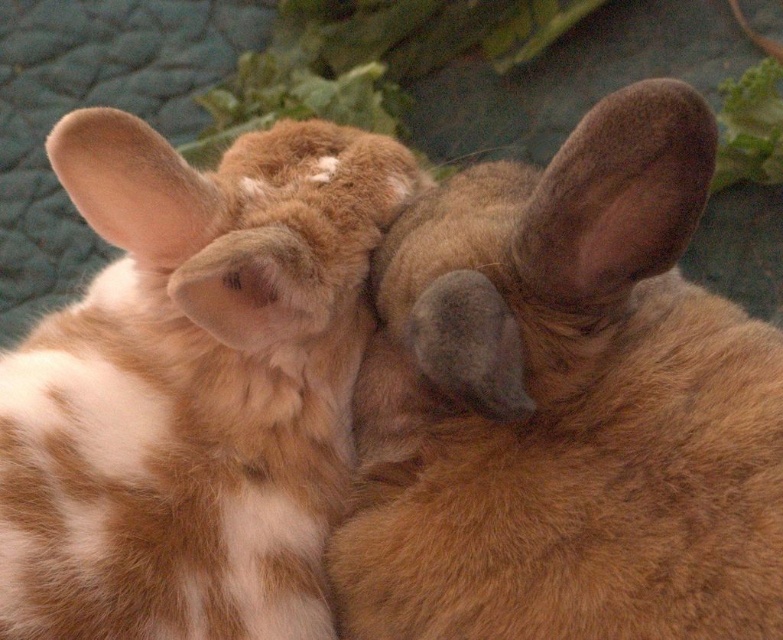
From the picture: Who is shorter, brown furry rabbit at center or fuzzy brown ear at upper left?

fuzzy brown ear at upper left

Can you confirm if brown furry rabbit at center is taller than fuzzy brown ear at upper left?

Yes, brown furry rabbit at center is taller than fuzzy brown ear at upper left.

Who is more distant from viewer, (699, 609) or (110, 198)?

Positioned behind is point (110, 198).

You are a GUI agent. You are given a task and a screenshot of the screen. Output one action in this format:
    pyautogui.click(x=<x>, y=<y>)
    Task: Click on the brown furry rabbit at center
    This screenshot has width=783, height=640.
    Given the screenshot: What is the action you would take?
    pyautogui.click(x=565, y=404)

Is fuzzy brown ear at upper left wider than gray soft fur ear at center?

Yes.

Looking at this image, can you confirm if fuzzy brown ear at upper left is bigger than gray soft fur ear at center?

Yes.

Is point (182, 234) more distant than point (511, 381)?

Yes.

Locate an element on the screen. Image resolution: width=783 pixels, height=640 pixels. fuzzy brown ear at upper left is located at coordinates (134, 186).

Does brown furry ear at upper right come in front of fuzzy brown ear at upper left?

Yes, brown furry ear at upper right is in front of fuzzy brown ear at upper left.

Between brown furry ear at upper right and fuzzy brown ear at upper left, which one is positioned lower?

brown furry ear at upper right is below.

Locate an element on the screen. brown furry ear at upper right is located at coordinates (616, 196).